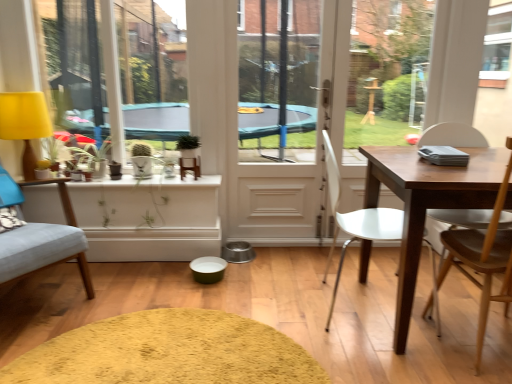
This screenshot has height=384, width=512. Find the location of `free spot above soft yellow rug at center (from a real-world perspective)`. free spot above soft yellow rug at center (from a real-world perspective) is located at coordinates (159, 339).